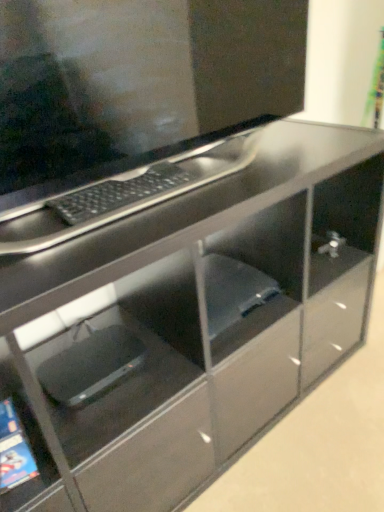
Question: Does matte black monitor at upper center have a lesser height compared to black plastic laptop at lower left?

Choices:
 (A) yes
 (B) no

Answer: (B)

Question: From the image's perspective, is matte black monitor at upper center over black plastic laptop at lower left?

Choices:
 (A) no
 (B) yes

Answer: (B)

Question: Is black plastic laptop at lower left completely or partially inside matte black monitor at upper center?

Choices:
 (A) no
 (B) yes

Answer: (A)

Question: Is matte black monitor at upper center bigger than black plastic laptop at lower left?

Choices:
 (A) no
 (B) yes

Answer: (B)

Question: Does matte black monitor at upper center have a smaller size compared to black plastic laptop at lower left?

Choices:
 (A) no
 (B) yes

Answer: (A)

Question: Looking at the image, does matte black monitor at upper center seem bigger or smaller compared to black matte keyboard at upper center?

Choices:
 (A) big
 (B) small

Answer: (A)

Question: From a real-world perspective, is matte black monitor at upper center positioned above or below black matte keyboard at upper center?

Choices:
 (A) above
 (B) below

Answer: (A)

Question: Is matte black monitor at upper center in front of or behind black matte keyboard at upper center in the image?

Choices:
 (A) front
 (B) behind

Answer: (A)

Question: Considering the positions of matte black monitor at upper center and black matte keyboard at upper center in the image, is matte black monitor at upper center taller or shorter than black matte keyboard at upper center?

Choices:
 (A) short
 (B) tall

Answer: (B)

Question: Is point (77, 210) positioned closer to the camera than point (99, 133)?

Choices:
 (A) farther
 (B) closer

Answer: (B)

Question: Considering the relative positions of black matte keyboard at upper center and matte black monitor at upper center in the image provided, is black matte keyboard at upper center to the left or to the right of matte black monitor at upper center?

Choices:
 (A) left
 (B) right

Answer: (A)

Question: From the image's perspective, is black matte keyboard at upper center located above or below matte black monitor at upper center?

Choices:
 (A) below
 (B) above

Answer: (A)

Question: Is black matte keyboard at upper center spatially inside matte black monitor at upper center, or outside of it?

Choices:
 (A) outside
 (B) inside

Answer: (B)

Question: In terms of height, does black plastic laptop at lower left look taller or shorter compared to matte black monitor at upper center?

Choices:
 (A) short
 (B) tall

Answer: (A)

Question: Do you think black plastic laptop at lower left is within matte black monitor at upper center, or outside of it?

Choices:
 (A) outside
 (B) inside

Answer: (A)